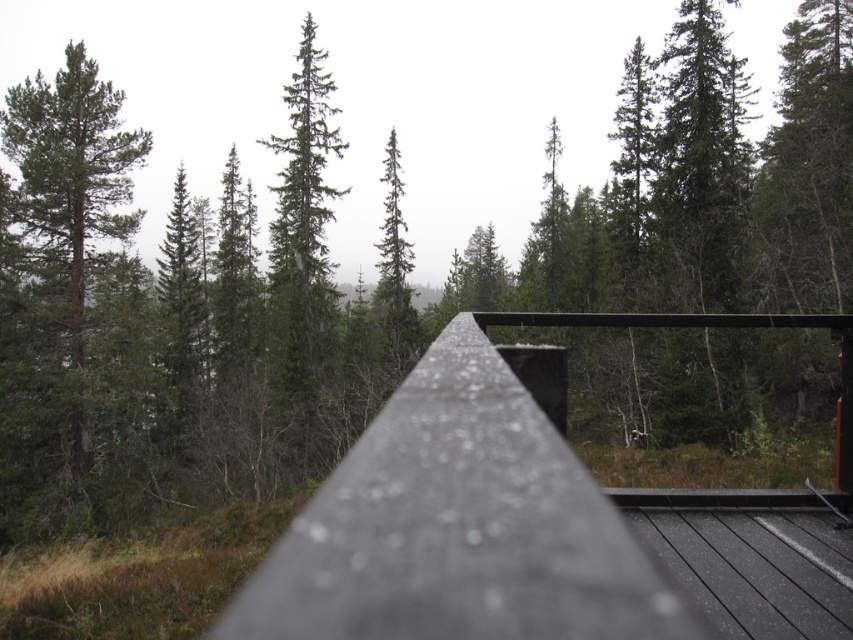
You are standing on a wooden deck and want to locate the smooth black deck at center. According to the coordinates provided, where should you look?

The smooth black deck at center is located at point coordinates (540, 522).

You are standing on the wooden deck and want to place a large potted plant between the smooth black deck at center and the green matte tree at left. Considering their sizes, which object should the plant be closer to?

The smooth black deck at center is smaller than the green matte tree at left, so the plant should be placed closer to the green matte tree at left to balance the sizes.